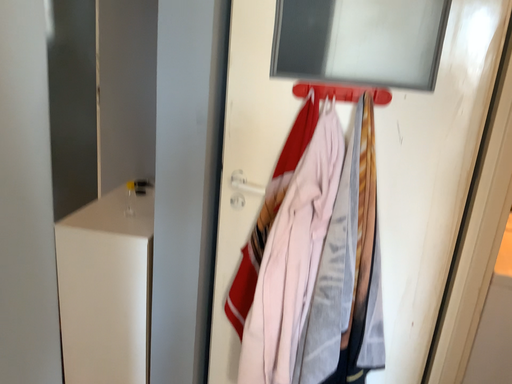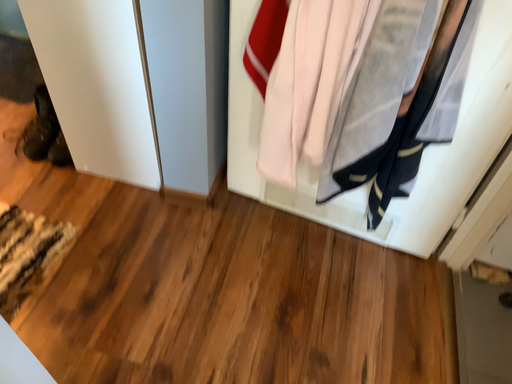
Question: How did the camera likely rotate when shooting the video?

Choices:
 (A) rotated upward
 (B) rotated downward

Answer: (B)